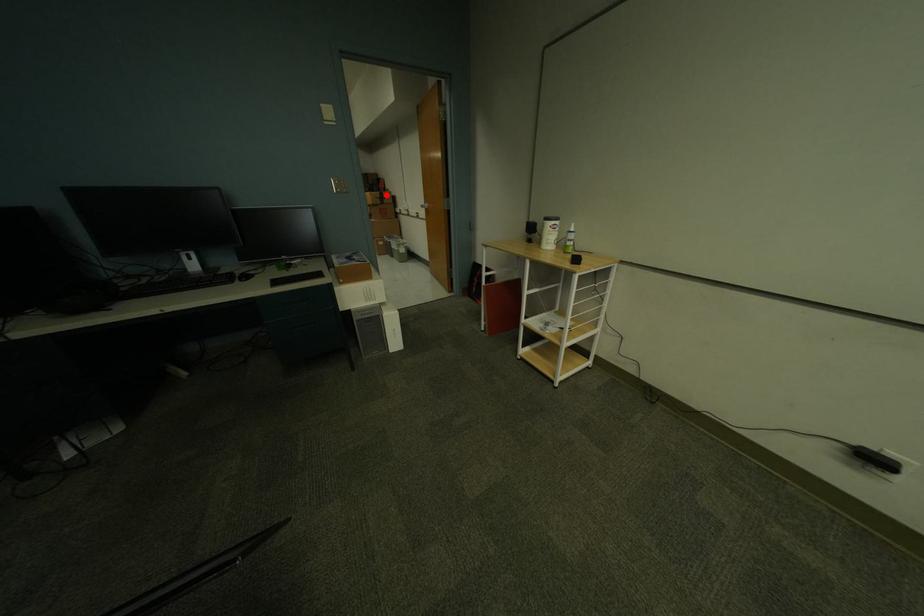
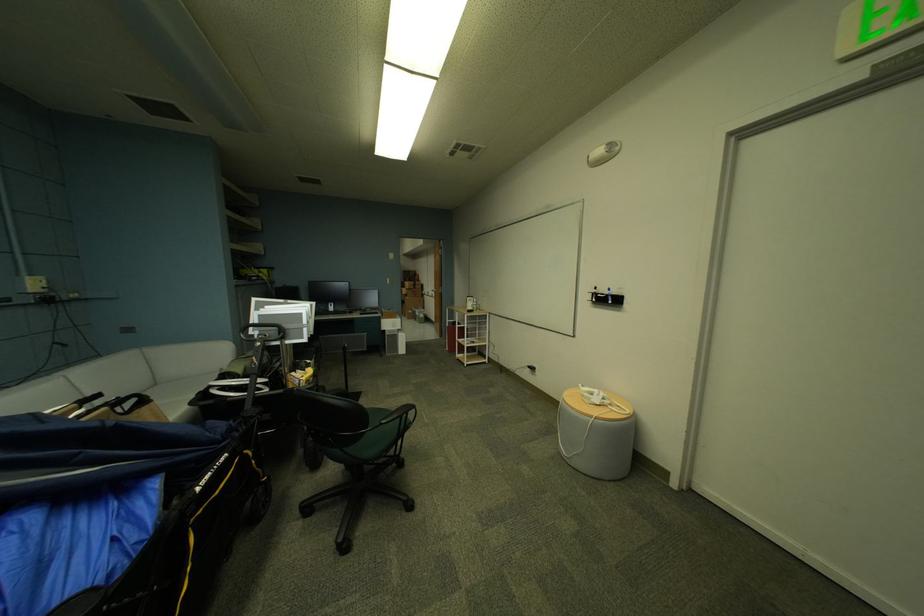
Locate, in the second image, the point that corresponds to the highlighted location in the first image.

(421, 284)